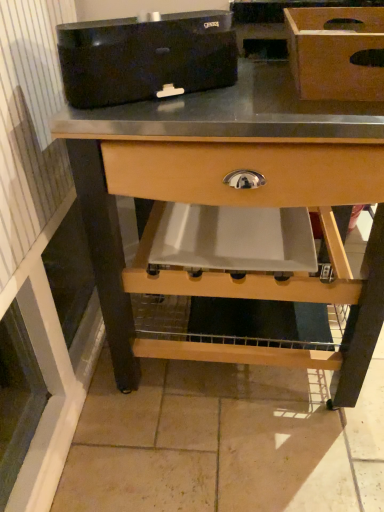
Question: Does natural wood table at center have a greater width compared to black plastic toaster at upper center?

Choices:
 (A) no
 (B) yes

Answer: (B)

Question: Considering the relative sizes of natural wood table at center and black plastic toaster at upper center in the image provided, is natural wood table at center thinner than black plastic toaster at upper center?

Choices:
 (A) no
 (B) yes

Answer: (A)

Question: Are natural wood table at center and black plastic toaster at upper center located far from each other?

Choices:
 (A) no
 (B) yes

Answer: (A)

Question: Is natural wood table at center to the left of black plastic toaster at upper center from the viewer's perspective?

Choices:
 (A) no
 (B) yes

Answer: (A)

Question: Can black plastic toaster at upper center be found inside natural wood table at center?

Choices:
 (A) yes
 (B) no

Answer: (B)

Question: Is natural wood table at center looking in the opposite direction of black plastic toaster at upper center?

Choices:
 (A) yes
 (B) no

Answer: (B)

Question: Does black plastic toaster at upper center have a greater height compared to wooden box at upper right?

Choices:
 (A) yes
 (B) no

Answer: (A)

Question: Considering the relative positions of black plastic toaster at upper center and wooden box at upper right in the image provided, is black plastic toaster at upper center to the right of wooden box at upper right from the viewer's perspective?

Choices:
 (A) yes
 (B) no

Answer: (B)

Question: Does black plastic toaster at upper center have a lesser height compared to wooden box at upper right?

Choices:
 (A) no
 (B) yes

Answer: (A)

Question: Is black plastic toaster at upper center bigger than wooden box at upper right?

Choices:
 (A) no
 (B) yes

Answer: (A)

Question: Can you confirm if black plastic toaster at upper center is smaller than wooden box at upper right?

Choices:
 (A) yes
 (B) no

Answer: (A)

Question: Is black plastic toaster at upper center outside of wooden box at upper right?

Choices:
 (A) no
 (B) yes

Answer: (B)

Question: Can you confirm if wooden box at upper right is shorter than natural wood table at center?

Choices:
 (A) no
 (B) yes

Answer: (B)